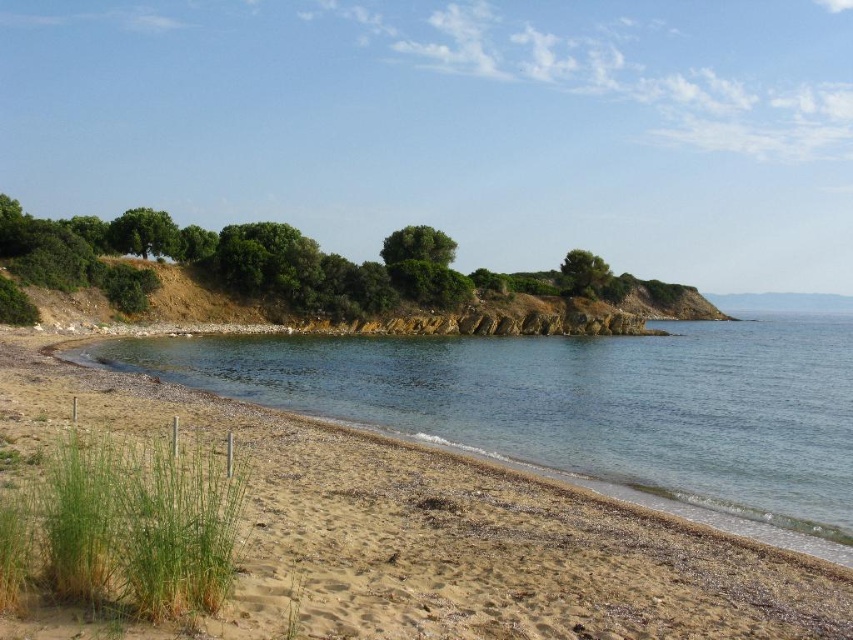
Question: Among these points, which one is nearest to the camera?

Choices:
 (A) (573, 262)
 (B) (405, 355)

Answer: (B)

Question: Can you confirm if clear water at lower left is positioned to the left of green leafy hillside at upper left?

Choices:
 (A) yes
 (B) no

Answer: (B)

Question: Does clear water at lower left come behind green leafy hillside at upper left?

Choices:
 (A) no
 (B) yes

Answer: (A)

Question: Is clear water at lower left positioned behind green leafy hillside at upper left?

Choices:
 (A) yes
 (B) no

Answer: (B)

Question: Which object is farther from the camera taking this photo?

Choices:
 (A) clear water at lower left
 (B) green leafy hillside at upper left

Answer: (B)